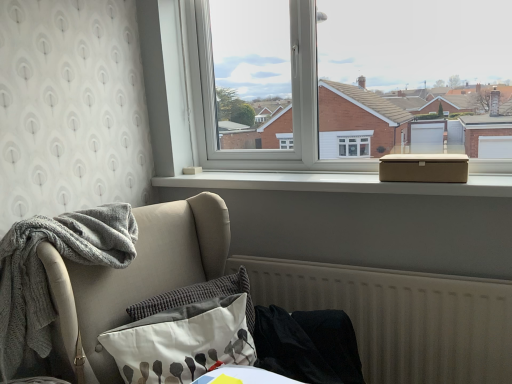
The width and height of the screenshot is (512, 384). Identify the location of empty space that is ontop of brown cardboard box at upper right. (420, 157).